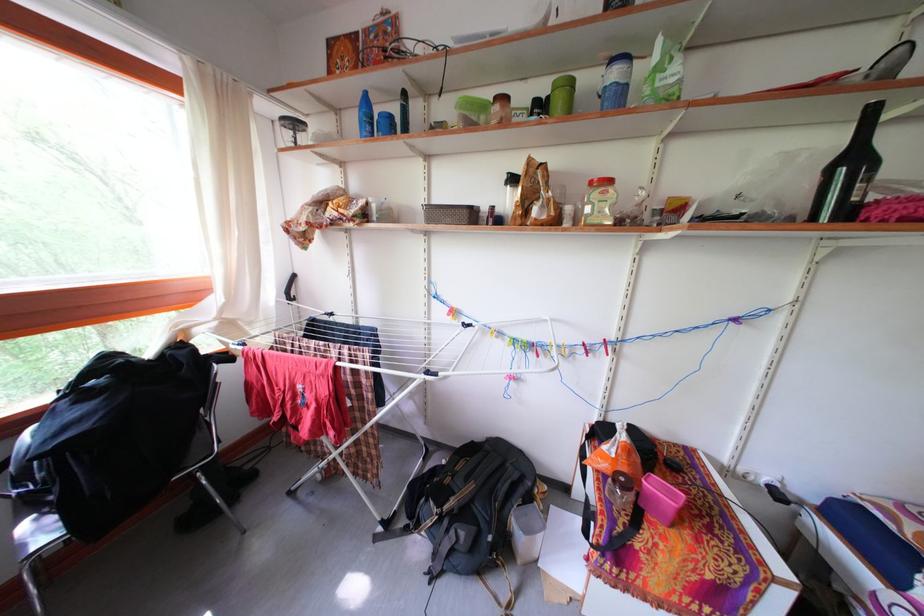
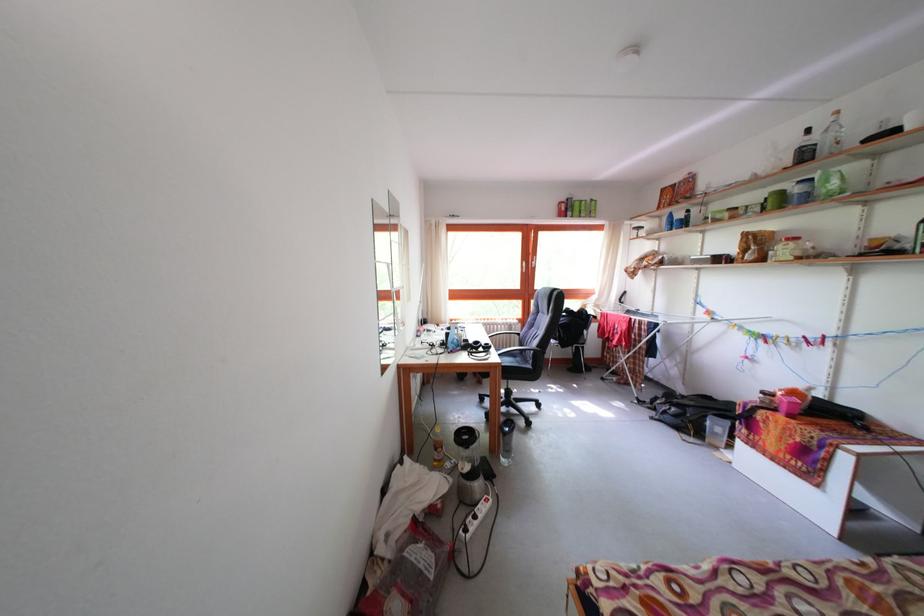
Where in the second image is the point corresponding to [345,116] from the first image?

(667, 224)